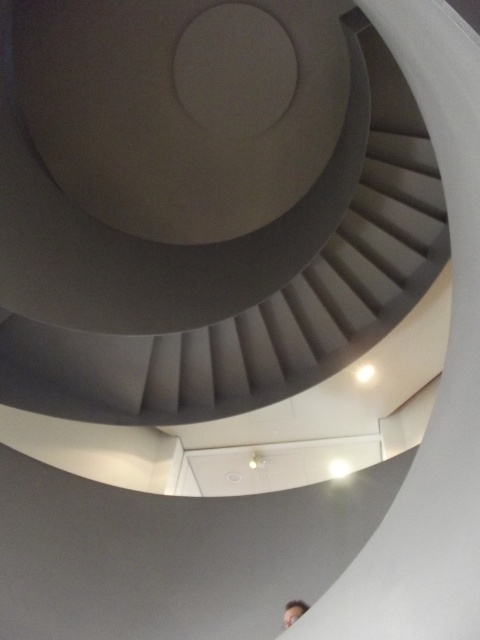
Question: Which point is farther from the camera taking this photo?

Choices:
 (A) (300, 291)
 (B) (285, 621)

Answer: (A)

Question: Does smooth gray stairs at center have a larger size compared to light brown hair at lower right?

Choices:
 (A) no
 (B) yes

Answer: (B)

Question: Does smooth gray stairs at center have a larger size compared to light brown hair at lower right?

Choices:
 (A) no
 (B) yes

Answer: (B)

Question: Is smooth gray stairs at center above light brown hair at lower right?

Choices:
 (A) yes
 (B) no

Answer: (A)